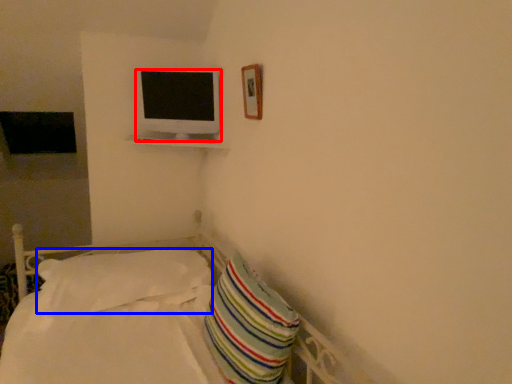
Question: Which object is closer to the camera taking this photo, television (highlighted by a red box) or pillow (highlighted by a blue box)?

Choices:
 (A) television
 (B) pillow

Answer: (B)